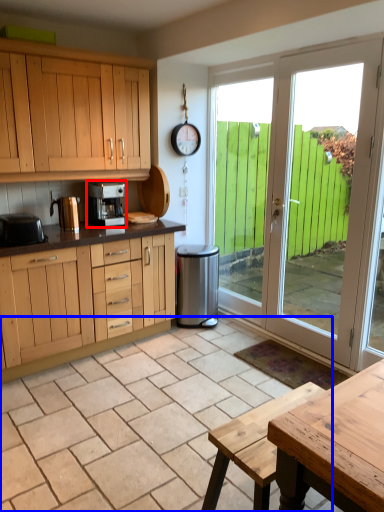
Question: Which of the following is the farthest to the observer, kitchen appliance (highlighted by a red box) or tile (highlighted by a blue box)?

Choices:
 (A) kitchen appliance
 (B) tile

Answer: (A)